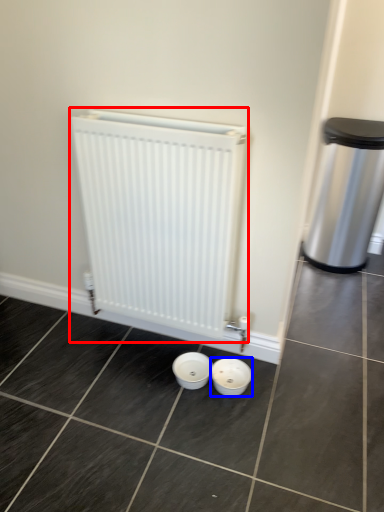
Question: Which object appears closest to the camera in this image, radiator (highlighted by a red box) or basin (highlighted by a blue box)?

Choices:
 (A) radiator
 (B) basin

Answer: (A)